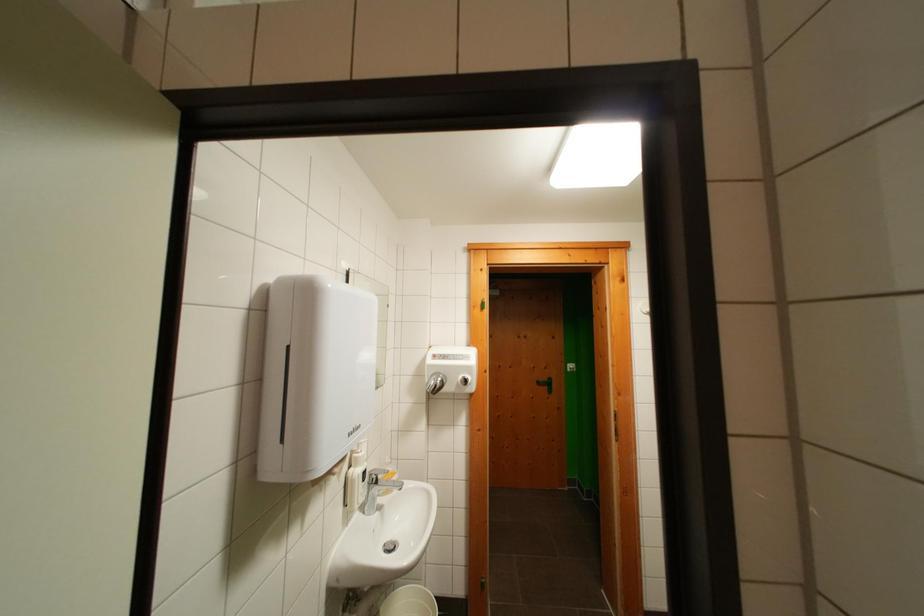
Describe the element at coordinates (359, 448) in the screenshot. This screenshot has width=924, height=616. I see `a soap dispenser pump` at that location.